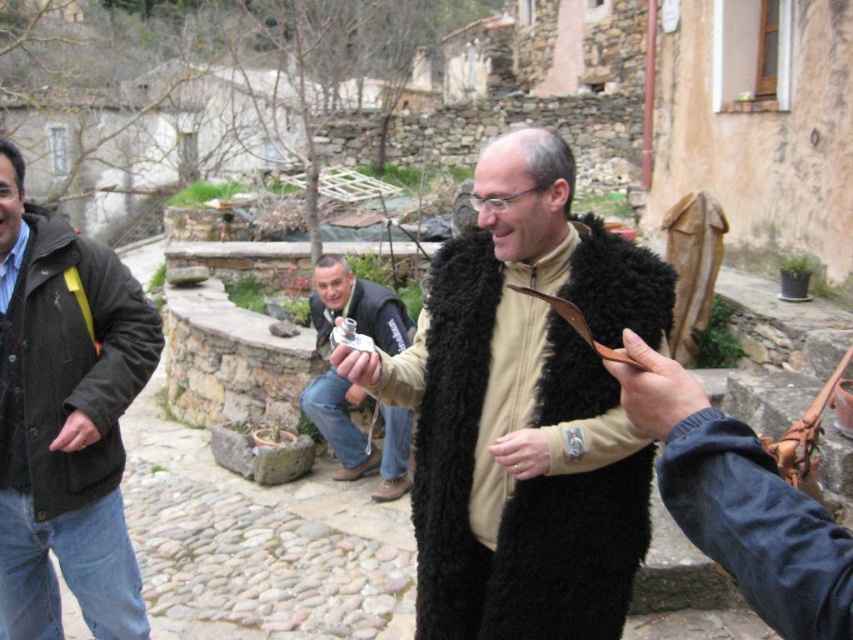
Question: Is metallic silver camera at center further to camera compared to matte black glove at lower left?

Choices:
 (A) no
 (B) yes

Answer: (B)

Question: Which object appears farthest from the camera in this image?

Choices:
 (A) metallic silver camera at center
 (B) dark green woolen jacket at left
 (C) matte black fur coat at center

Answer: (A)

Question: Which object appears closest to the camera in this image?

Choices:
 (A) dark green woolen jacket at left
 (B) brown fuzzy coat at center
 (C) matte black fur coat at center
 (D) brown leather hand at center

Answer: (D)

Question: Which of the following is the farthest from the observer?

Choices:
 (A) (355, 355)
 (B) (473, 515)
 (C) (637, 394)
 (D) (546, 448)

Answer: (B)

Question: Does dark green woolen jacket at left appear over metallic silver camera at center?

Choices:
 (A) yes
 (B) no

Answer: (B)

Question: Is brown fuzzy coat at center wider than matte silver watch at center?

Choices:
 (A) yes
 (B) no

Answer: (A)